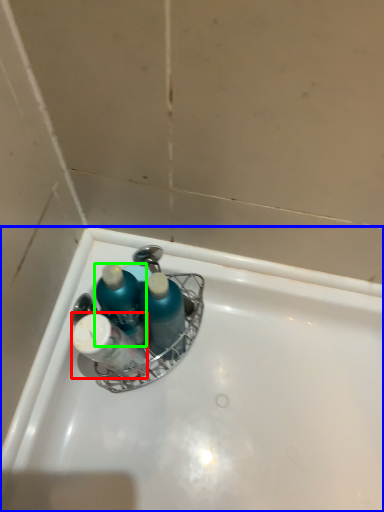
Question: Which object is the closest to the toiletry (highlighted by a red box)? Choose among these: bathtub (highlighted by a blue box) or mouthwash (highlighted by a green box).

Choices:
 (A) bathtub
 (B) mouthwash

Answer: (B)